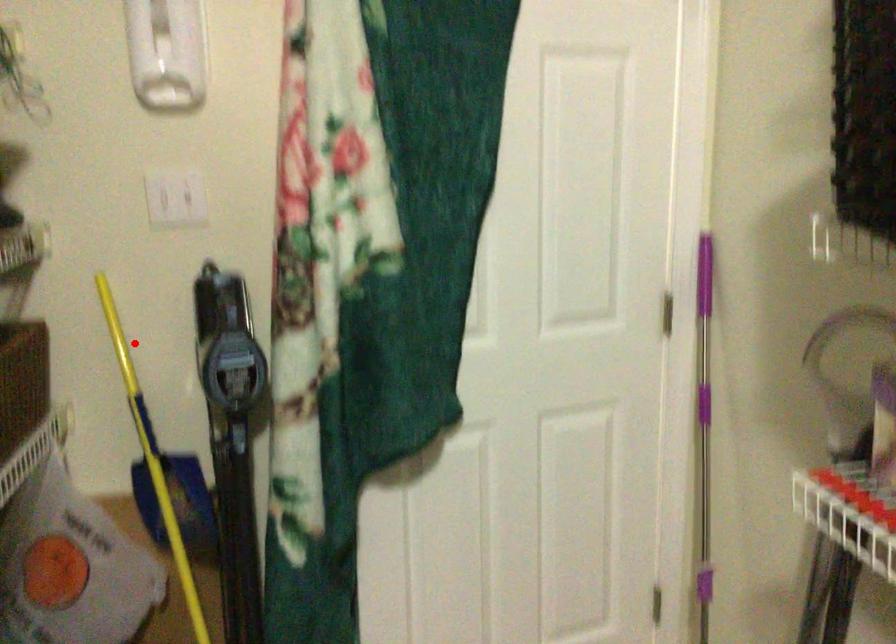
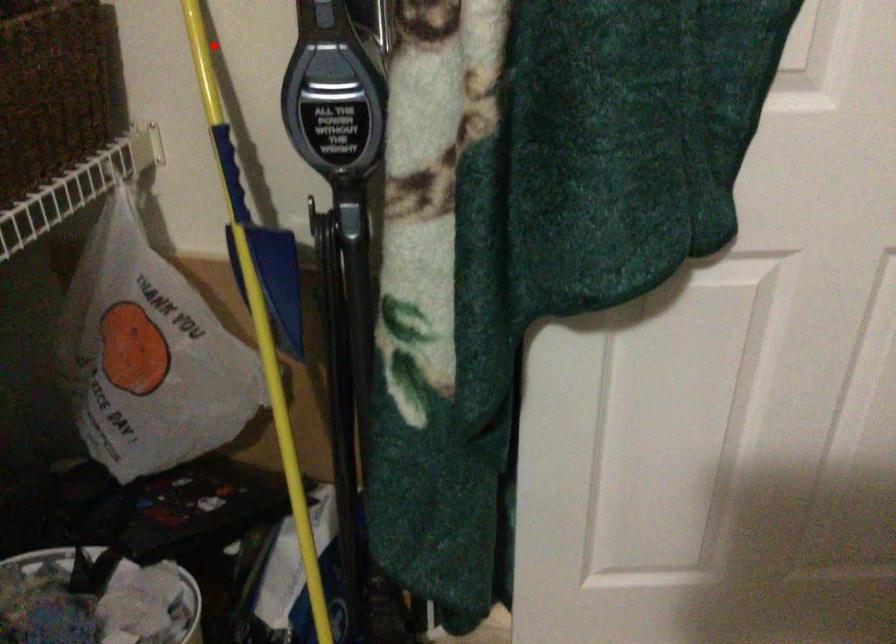
I am providing you with two images of the same scene from different viewpoints. A red point is marked on the first image and another point is marked on the second image. Does the point marked in image1 correspond to the same location as the one in image2?

Yes